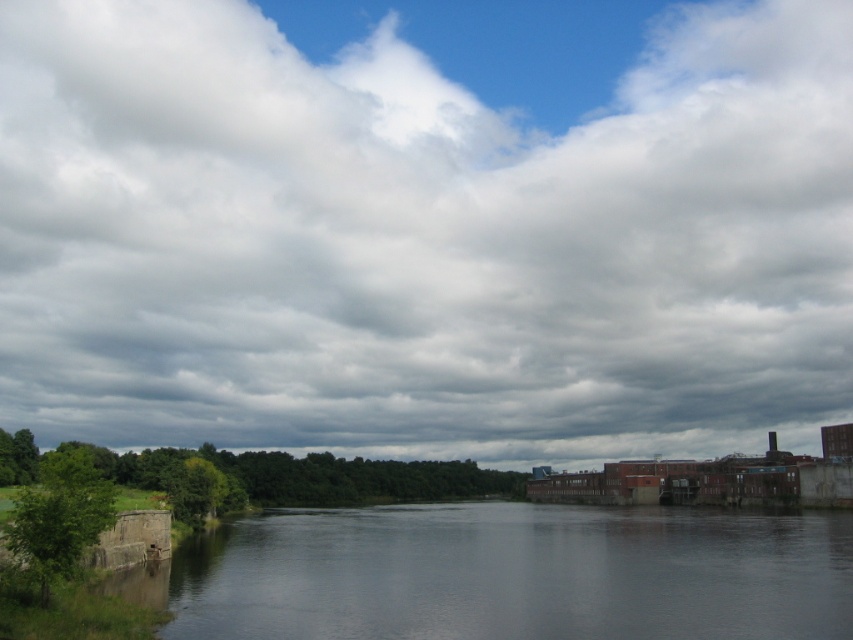
You are standing at the riverside and see the point marked at coordinates (421,241). What does this point indicate?

The point at (421,241) marks the cloudy sky at upper center.